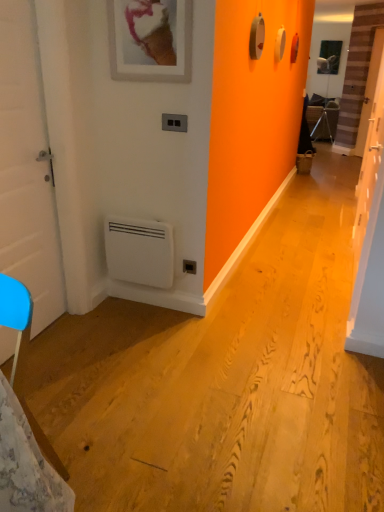
Question: Is black plastic electric outlet at lower center behind white matte door at left, acting as the first door starting from the left?

Choices:
 (A) yes
 (B) no

Answer: (A)

Question: Does black plastic electric outlet at lower center have a lesser height compared to white matte door at left, acting as the first door starting from the left?

Choices:
 (A) yes
 (B) no

Answer: (A)

Question: Is black plastic electric outlet at lower center far away from white matte door at left, acting as the first door starting from the left?

Choices:
 (A) yes
 (B) no

Answer: (A)

Question: From the image's perspective, is black plastic electric outlet at lower center over white matte door at left, acting as the first door starting from the left?

Choices:
 (A) yes
 (B) no

Answer: (B)

Question: Does black plastic electric outlet at lower center appear on the right side of white matte door at left, which is counted as the 2th door, starting from the right?

Choices:
 (A) no
 (B) yes

Answer: (B)

Question: Is black plastic electric outlet at lower center wider than white matte door at left, acting as the first door starting from the left?

Choices:
 (A) yes
 (B) no

Answer: (B)

Question: Considering the relative sizes of black plastic/light switch at upper center and white matte door at left, which is counted as the 2th door, starting from the right, in the image provided, is black plastic/light switch at upper center thinner than white matte door at left, which is counted as the 2th door, starting from the right,?

Choices:
 (A) yes
 (B) no

Answer: (A)

Question: Is black plastic/light switch at upper center smaller than white matte door at left, which is counted as the 2th door, starting from the right?

Choices:
 (A) yes
 (B) no

Answer: (A)

Question: Does black plastic/light switch at upper center have a greater width compared to white matte door at left, which is counted as the 2th door, starting from the right?

Choices:
 (A) no
 (B) yes

Answer: (A)

Question: Is black plastic/light switch at upper center oriented towards white matte door at left, acting as the first door starting from the left?

Choices:
 (A) yes
 (B) no

Answer: (B)

Question: Is black plastic/light switch at upper center shorter than white matte door at left, which is counted as the 2th door, starting from the right?

Choices:
 (A) no
 (B) yes

Answer: (B)

Question: Considering the relative sizes of black plastic/light switch at upper center and white matte door at left, acting as the first door starting from the left, in the image provided, is black plastic/light switch at upper center bigger than white matte door at left, acting as the first door starting from the left,?

Choices:
 (A) no
 (B) yes

Answer: (A)

Question: Does white matte door at left, acting as the first door starting from the left, come behind black plastic/light switch at upper center?

Choices:
 (A) no
 (B) yes

Answer: (A)